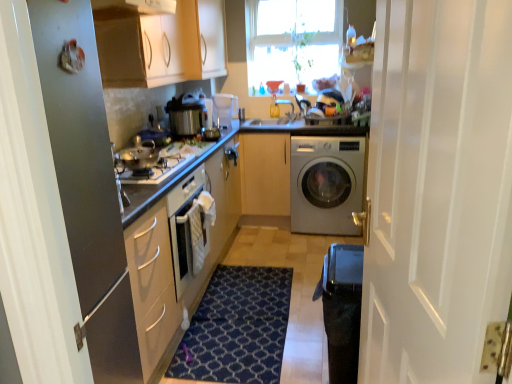
At what (x,y) coordinates should I click in order to perform the action: click on white glossy washing machine at center. Please return your answer as a coordinate pair (x, y). Looking at the image, I should click on (326, 184).

The width and height of the screenshot is (512, 384). Describe the element at coordinates (157, 170) in the screenshot. I see `shiny silver gas stove at center left` at that location.

At what (x,y) coordinates should I click in order to perform the action: click on shiny silver gas stove at center left. Please return your answer as a coordinate pair (x, y). Image resolution: width=512 pixels, height=384 pixels. Looking at the image, I should click on (157, 170).

The width and height of the screenshot is (512, 384). What do you see at coordinates (342, 309) in the screenshot? I see `black textured water heater at lower right` at bounding box center [342, 309].

Image resolution: width=512 pixels, height=384 pixels. I want to click on dark blue textured rug at center, so click(x=237, y=328).

From a real-world perspective, is translucent glass coffee cup at upper center located beneath matte white cabinet at upper center, the first cabinetry viewed from the left?

Yes, from a real-world perspective, translucent glass coffee cup at upper center is beneath matte white cabinet at upper center, the first cabinetry viewed from the left.

Is translucent glass coffee cup at upper center oriented towards matte white cabinet at upper center, which is the 1th cabinetry from top to bottom?

No.

The image size is (512, 384). I want to click on coffee cup below the matte white cabinet at upper center, which is the 1th cabinetry from top to bottom (from a real-world perspective), so click(x=274, y=107).

Considering the sizes of objects translucent glass coffee cup at upper center and matte white cabinet at upper center, the first cabinetry viewed from the left, in the image provided, who is shorter, translucent glass coffee cup at upper center or matte white cabinet at upper center, the first cabinetry viewed from the left,?

translucent glass coffee cup at upper center.

Which object is more forward, shiny silver gas stove at center left or translucent glass coffee cup at upper center?

Positioned in front is shiny silver gas stove at center left.

From the image's perspective, does shiny silver gas stove at center left appear lower than translucent glass coffee cup at upper center?

Yes.

Looking at their sizes, would you say shiny silver gas stove at center left is wider or thinner than translucent glass coffee cup at upper center?

In the image, shiny silver gas stove at center left appears to be wider than translucent glass coffee cup at upper center.

Considering the positions of objects clear glass window at upper center and metallic silver pot at center, which ranks as the 2th appliance in bottom-to-top order, in the image provided, who is in front, clear glass window at upper center or metallic silver pot at center, which ranks as the 2th appliance in bottom-to-top order,?

metallic silver pot at center, which ranks as the 2th appliance in bottom-to-top order.

Is point (276, 67) positioned behind point (221, 111)?

Yes, it is behind point (221, 111).

Is clear glass window at upper center at the right side of metallic silver pot at center, which ranks as the second appliance in front-to-back order?

Yes, clear glass window at upper center is to the right of metallic silver pot at center, which ranks as the second appliance in front-to-back order.

Looking at this image, from the image's perspective, is clear glass window at upper center positioned above or below metallic silver pot at center, the 1th appliance when ordered from back to front?

From the image's perspective, clear glass window at upper center appears above metallic silver pot at center, the 1th appliance when ordered from back to front.

How different are the orientations of shiny silver gas stove at center left and black textured water heater at lower right in degrees?

There is a 180-degree angle between the facing directions of shiny silver gas stove at center left and black textured water heater at lower right.

Does shiny silver gas stove at center left appear on the right side of black textured water heater at lower right?

In fact, shiny silver gas stove at center left is to the left of black textured water heater at lower right.

From a real-world perspective, is shiny silver gas stove at center left above or below black textured water heater at lower right?

In terms of real-world spatial position, shiny silver gas stove at center left is above black textured water heater at lower right.

Is shiny silver gas stove at center left positioned far away from black textured water heater at lower right?

No, shiny silver gas stove at center left is not far away from black textured water heater at lower right.

Is metallic silver refrigerator at left to the left or to the right of black plastic door handle at center in the image?

In the image, metallic silver refrigerator at left appears on the left side of black plastic door handle at center.

From a real-world perspective, is metallic silver refrigerator at left over black plastic door handle at center?

Yes, from a real-world perspective, metallic silver refrigerator at left is over black plastic door handle at center

Between metallic silver refrigerator at left and black plastic door handle at center, which one is positioned in front?

Positioned in front is metallic silver refrigerator at left.

Can we say metallic silver refrigerator at left lies outside black plastic door handle at center?

Yes, metallic silver refrigerator at left is outside of black plastic door handle at center.

Is dark blue textured rug at center positioned with its back to shiny metallic pan at center-left, the second appliance positioned from the back?

That's not correct — dark blue textured rug at center is not looking away from shiny metallic pan at center-left, the second appliance positioned from the back.

Considering the sizes of objects dark blue textured rug at center and shiny metallic pan at center-left, which ranks as the 1th appliance in front-to-back order, in the image provided, who is wider, dark blue textured rug at center or shiny metallic pan at center-left, which ranks as the 1th appliance in front-to-back order,?

dark blue textured rug at center.

From a real-world perspective, is dark blue textured rug at center positioned under shiny metallic pan at center-left, arranged as the second appliance when viewed from the right, based on gravity?

Yes.

Who is more distant, light wood/texture cabinet at center, the 2th cabinetry positioned from the top, or white glossy washing machine at center?

light wood/texture cabinet at center, the 2th cabinetry positioned from the top.

Are light wood/texture cabinet at center, acting as the 2th cabinetry starting from the left, and white glossy washing machine at center making contact?

No, light wood/texture cabinet at center, acting as the 2th cabinetry starting from the left, is not in contact with white glossy washing machine at center.

Do you think light wood/texture cabinet at center, the 2th cabinetry positioned from the top, is within white glossy washing machine at center, or outside of it?

light wood/texture cabinet at center, the 2th cabinetry positioned from the top, cannot be found inside white glossy washing machine at center.

Can you confirm if light wood/texture cabinet at center, the 2th cabinetry positioned from the top, is positioned to the left of white glossy washing machine at center?

Correct, you'll find light wood/texture cabinet at center, the 2th cabinetry positioned from the top, to the left of white glossy washing machine at center.

The image size is (512, 384). In the image, there is a matte white cabinet at upper center, the first cabinetry viewed from the left. Find the location of `coffee cup below it (from a real-world perspective)`. coffee cup below it (from a real-world perspective) is located at coordinates (274, 107).

Locate an element on the screen. gas stove on the left of translucent glass coffee cup at upper center is located at coordinates tap(157, 170).

Based on their spatial positions, is metallic silver pot at center, placed as the 1th appliance when sorted from right to left, or black plastic door handle at center closer to clear glass window at upper center?

metallic silver pot at center, placed as the 1th appliance when sorted from right to left, is positioned closer to the anchor clear glass window at upper center.

Which object lies further to the anchor point shiny silver gas stove at center left, dark blue textured rug at center or black textured water heater at lower right?

Among the two, black textured water heater at lower right is located further to shiny silver gas stove at center left.

Looking at this image, based on their spatial positions, is white wood door at right or matte white cabinet at upper center, which is the 1th cabinetry from top to bottom, further from shiny metallic pan at center-left, which ranks as the 1th appliance in front-to-back order?

Among the two, white wood door at right is located further to shiny metallic pan at center-left, which ranks as the 1th appliance in front-to-back order.

Considering their positions, is metallic silver pot at center, which ranks as the second appliance in front-to-back order, positioned closer to light wood/texture cabinet at center, which is counted as the first cabinetry, starting from the right, than matte white cabinet at upper center, which is counted as the second cabinetry, starting from the right?

Among the two, metallic silver pot at center, which ranks as the second appliance in front-to-back order, is located nearer to light wood/texture cabinet at center, which is counted as the first cabinetry, starting from the right.

From the image, which object appears to be farther from matte white cabinet at upper center, the first cabinetry viewed from the left, black plastic door handle at center or black textured water heater at lower right?

black textured water heater at lower right is further to matte white cabinet at upper center, the first cabinetry viewed from the left.

Estimate the real-world distances between objects in this image. Which object is further from white wood door at right, white glossy washing machine at center or translucent glass coffee cup at upper center?

translucent glass coffee cup at upper center is positioned further to the anchor white wood door at right.

Based on their spatial positions, is matte white cabinet at upper center, which is counted as the second cabinetry, starting from the right, or clear glass window at upper center closer to black plastic door handle at center?

Based on the image, matte white cabinet at upper center, which is counted as the second cabinetry, starting from the right, appears to be nearer to black plastic door handle at center.

Looking at the image, which one is located further to metallic silver refrigerator at left, translucent glass coffee cup at upper center or white wood door at right?

translucent glass coffee cup at upper center is further to metallic silver refrigerator at left.

Locate an element on the screen. counter top between clear glass window at upper center and black plastic door handle at center in the vertical direction is located at coordinates (307, 126).

Locate an element on the screen. The image size is (512, 384). counter top between shiny metallic pan at center-left, arranged as the first appliance when ordered from the bottom, and metallic silver pot at center, placed as the 1th appliance when sorted from right to left, in the front-back direction is located at coordinates (307, 126).

At what (x,y) coordinates should I click in order to perform the action: click on counter top between black plastic door handle at center and translucent glass coffee cup at upper center along the z-axis. Please return your answer as a coordinate pair (x, y). This screenshot has height=384, width=512. Looking at the image, I should click on (307, 126).

This screenshot has width=512, height=384. Find the location of `counter top positioned between black textured water heater at lower right and metallic silver pot at center, the 1th appliance when ordered from back to front, from near to far`. counter top positioned between black textured water heater at lower right and metallic silver pot at center, the 1th appliance when ordered from back to front, from near to far is located at coordinates point(307,126).